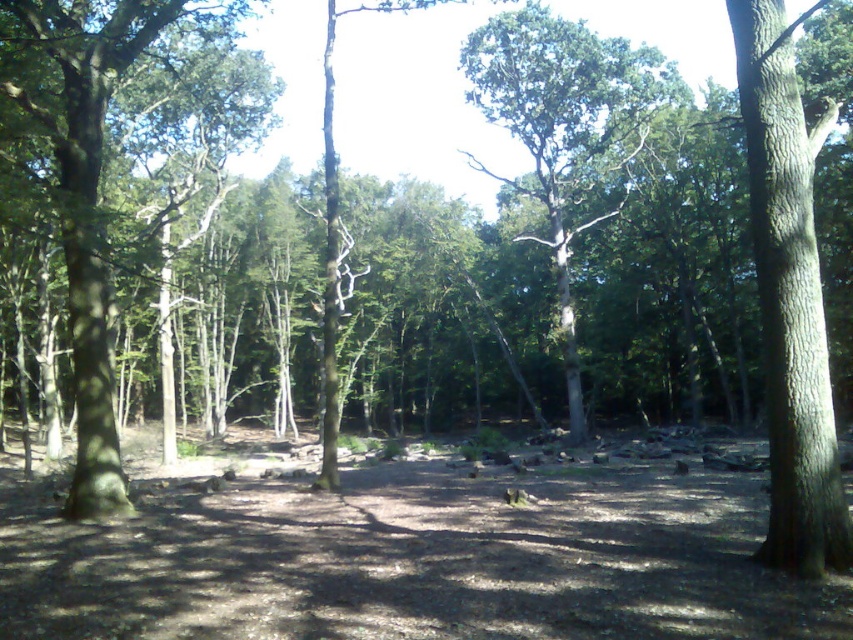
You are a hiker navigating through the forest and want to reach the clearing beyond the trees. You see a green leafy tree at center and a green matte tree at left. Which tree is closer to you as you walk towards the clearing?

The green leafy tree at center is closer to you because the green matte tree at left is behind it, meaning the leafy tree is in front.

You are a hiker trying to find a path through the forest. You notice a smooth bark tree at right and a green leafy tree at center. Which tree would block your view of the other tree if you are standing between them?

The smooth bark tree at right is in front of the green leafy tree at center, so it would block your view of the green leafy tree at center.

You are a hiker navigating through the forest and want to move from the point closer to you to the point further away. Which path should you take between the point at coordinates (834, 435) and the point at coordinates (148, 44)?

You should move from the point at coordinates (834, 435) to the point at coordinates (148, 44) because point (834, 435) is closer to the viewer and you want to go to the point further away.